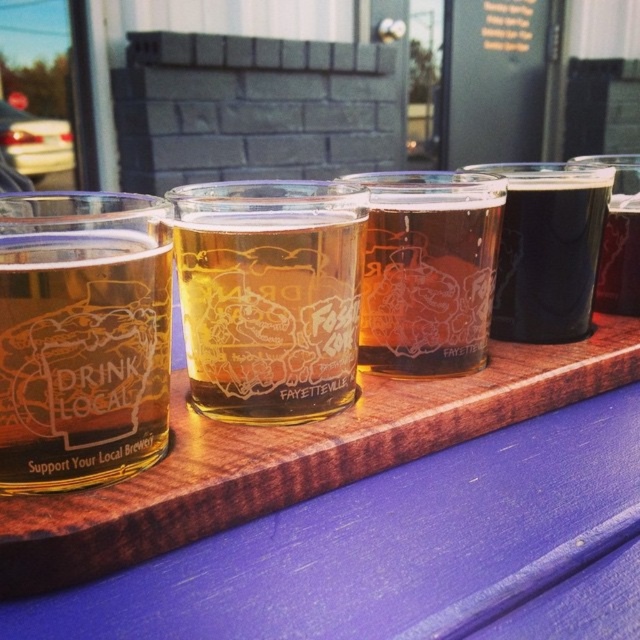
Question: Which object is closer to the camera taking this photo?

Choices:
 (A) wooden tray at center
 (B) translucent glass beer glass at center
 (C) translucent glass at upper right
 (D) black matte glass at center

Answer: (A)

Question: Among these objects, which one is farthest from the camera?

Choices:
 (A) matte glass at left
 (B) black matte glass at center
 (C) translucent glass at upper right

Answer: (C)

Question: Considering the relative positions of matte glass at left and black matte glass at center in the image provided, where is matte glass at left located with respect to black matte glass at center?

Choices:
 (A) right
 (B) left

Answer: (B)

Question: Where is wooden tray at center located in relation to translucent glass at center in the image?

Choices:
 (A) above
 (B) below

Answer: (B)

Question: Which of the following is the closest to the observer?

Choices:
 (A) (636, 275)
 (B) (365, 241)

Answer: (B)

Question: Is translucent glass beer glass at center above translucent glass at upper right?

Choices:
 (A) yes
 (B) no

Answer: (B)